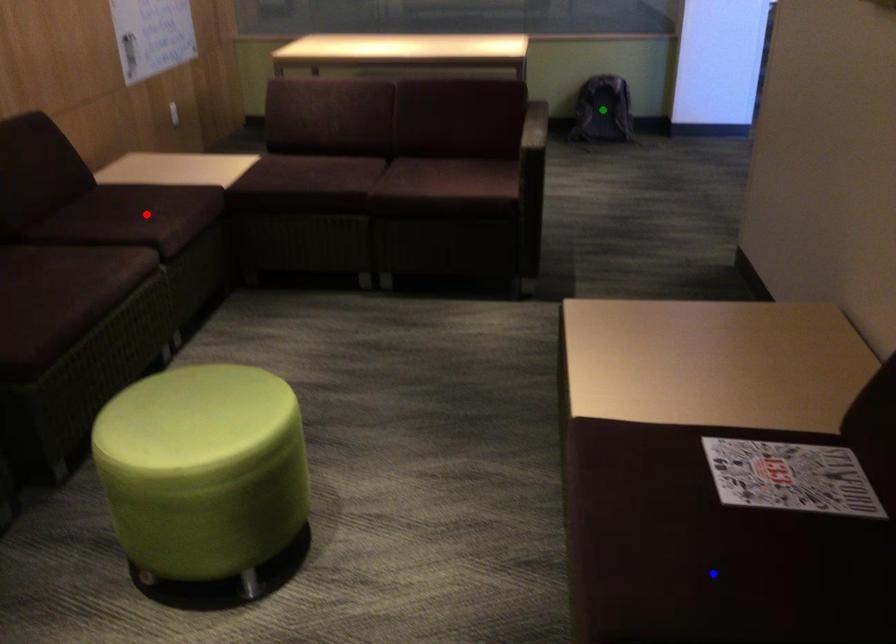
Order these from farthest to nearest:
A) red point
B) blue point
C) green point

1. green point
2. red point
3. blue point